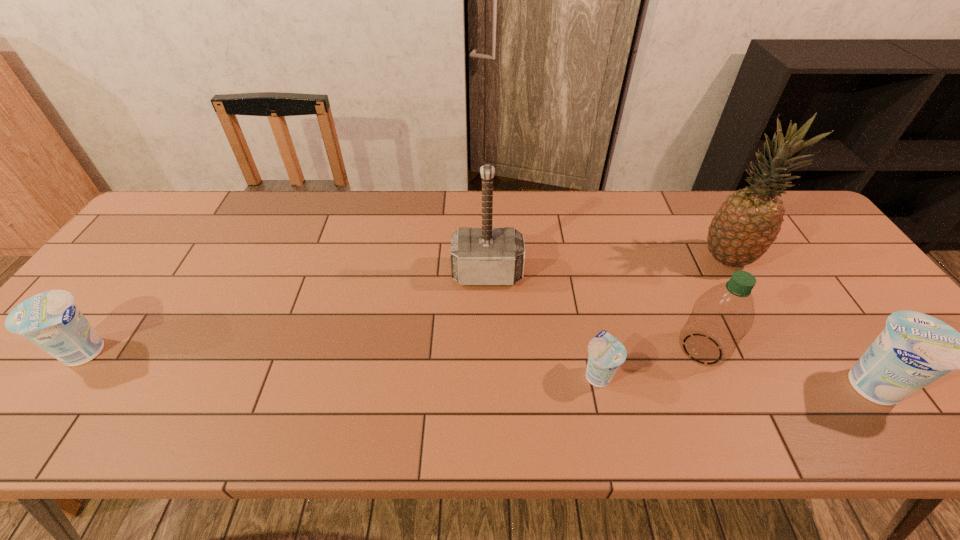
Find the location of a particular element. free space located 0.110m on the right of the second tallest yogurt is located at coordinates (164, 352).

Find the location of a particular element. Image resolution: width=960 pixels, height=540 pixels. blank area located 0.370m on the back of the third object from left to right is located at coordinates (571, 249).

Where is `free location located on the right of the rightmost yogurt`? This screenshot has width=960, height=540. free location located on the right of the rightmost yogurt is located at coordinates (936, 386).

This screenshot has height=540, width=960. Find the location of `vacant region located 0.100m for striking with the head of the second object from left to right`. vacant region located 0.100m for striking with the head of the second object from left to right is located at coordinates (488, 319).

This screenshot has width=960, height=540. Find the location of `vacant space located on the front of the tallest object`. vacant space located on the front of the tallest object is located at coordinates (797, 383).

Locate an element on the screen. The height and width of the screenshot is (540, 960). vacant space positioned 0.320m on the right of the water bottle is located at coordinates point(863,349).

The height and width of the screenshot is (540, 960). Find the location of `water bottle at the near edge`. water bottle at the near edge is located at coordinates (721, 317).

Where is `object that is at the left edge`? This screenshot has width=960, height=540. object that is at the left edge is located at coordinates (51, 320).

Where is `object positioned at the right edge`? The height and width of the screenshot is (540, 960). object positioned at the right edge is located at coordinates (914, 349).

Locate an element on the screen. object present at the near left corner is located at coordinates (51, 320).